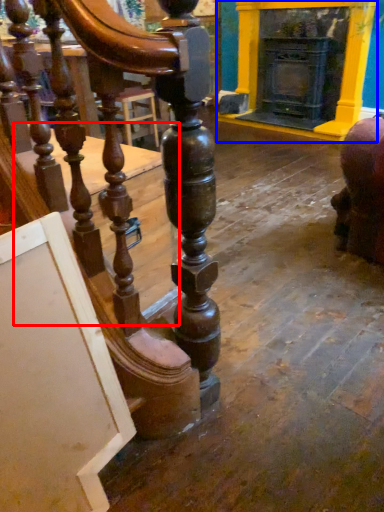
Question: Which object appears closest to the camera in this image, table (highlighted by a red box) or fireplace (highlighted by a blue box)?

Choices:
 (A) table
 (B) fireplace

Answer: (A)